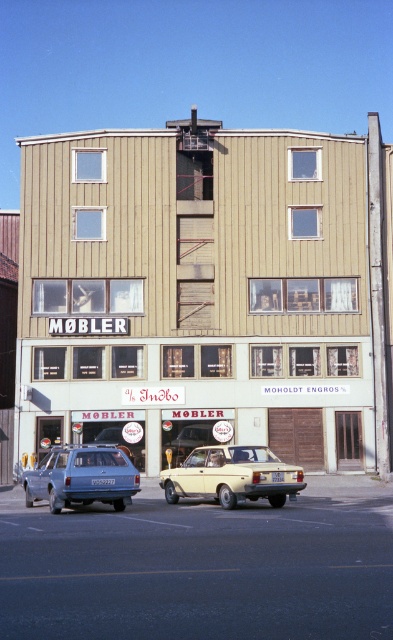
How much distance is there between wooden furniture at center and matte blue station wagon at lower left?

wooden furniture at center is 11.32 meters from matte blue station wagon at lower left.

Does wooden furniture at center have a greater height compared to matte blue station wagon at lower left?

→ Yes, wooden furniture at center is taller than matte blue station wagon at lower left.

Is point (380, 417) farther from viewer compared to point (126, 472)?

Yes, it is.

I want to click on wooden furniture at center, so click(x=207, y=292).

Is point (209, 481) positioned behind point (135, 480)?

Yes, point (209, 481) is behind point (135, 480).

Image resolution: width=393 pixels, height=640 pixels. Describe the element at coordinates (233, 476) in the screenshot. I see `yellow matte car at center` at that location.

The width and height of the screenshot is (393, 640). What are the coordinates of `yellow matte car at center` in the screenshot? It's located at (233, 476).

Does wooden furniture at center appear under yellow matte car at center?

No.

What do you see at coordinates (207, 292) in the screenshot? I see `wooden furniture at center` at bounding box center [207, 292].

Identify the location of wooden furniture at center. (207, 292).